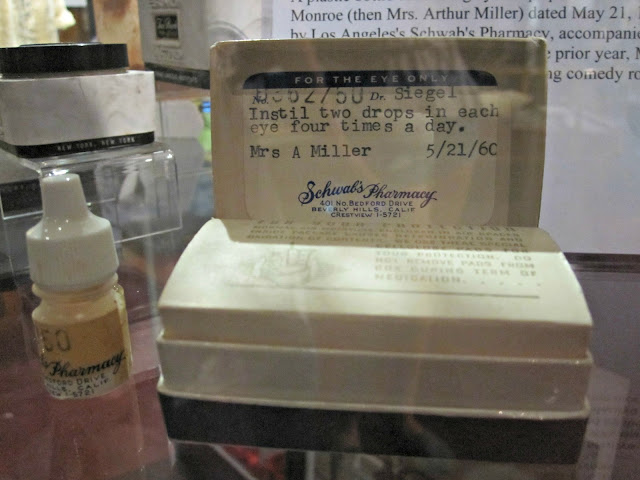
Find the location of a particular element. The height and width of the screenshot is (480, 640). ceramic box is located at coordinates tap(204, 383), tap(368, 389), tap(569, 384).